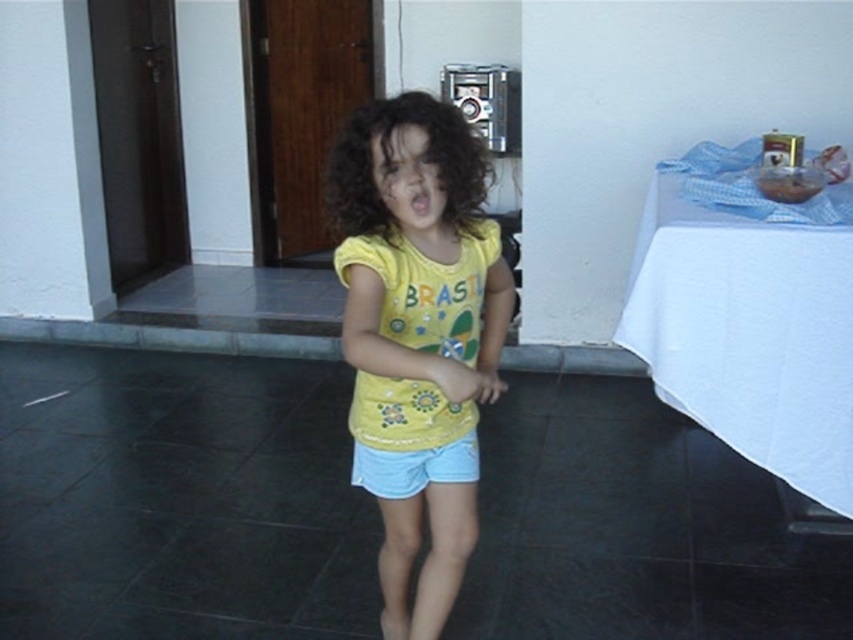
Question: Is curly brown hair at center below light blue denim shorts at center?

Choices:
 (A) yes
 (B) no

Answer: (B)

Question: Does white cloth at right appear under curly brown hair at center?

Choices:
 (A) yes
 (B) no

Answer: (A)

Question: Is yellow cotton shirt at center smaller than white cloth at right?

Choices:
 (A) yes
 (B) no

Answer: (A)

Question: Estimate the real-world distances between objects in this image. Which object is farther from the light blue denim shorts at center?

Choices:
 (A) white cloth at right
 (B) yellow cotton shirt at center

Answer: (A)

Question: Among these objects, which one is nearest to the camera?

Choices:
 (A) curly brown hair at center
 (B) yellow cotton shirt at center
 (C) light blue denim shorts at center

Answer: (B)

Question: Which object is the farthest from the white cloth at right?

Choices:
 (A) curly brown hair at center
 (B) yellow cotton shirt at center
 (C) light blue denim shorts at center

Answer: (A)